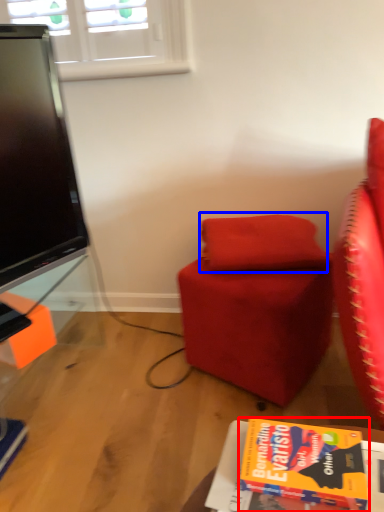
Question: Which point is further to the camera, book (highlighted by a red box) or pillow (highlighted by a blue box)?

Choices:
 (A) book
 (B) pillow

Answer: (B)